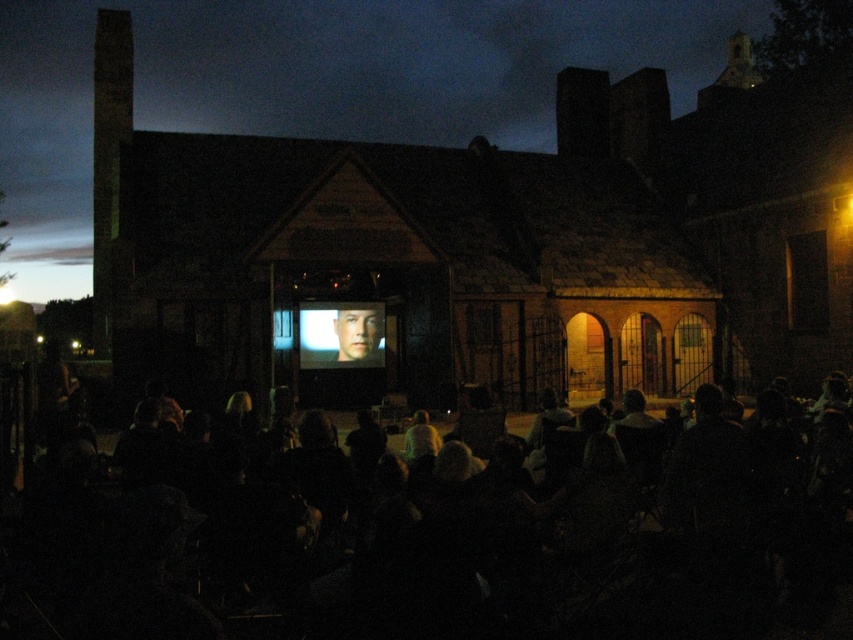
You are organizing a movie night and need to ensure there is enough space between the black fabric chairs at lower center and the matte silver screen at center for attendees to move comfortably. Based on the scene, which object is wider and would require more space?

The black fabric chairs at lower center are wider than the matte silver screen at center, so they would require more space.

You are standing at the point marked as point (440, 552) in the image. What is directly beneath your feet?

The point (440, 552) is directly on black fabric chairs at lower center.

You are a moviegoer trying to find a seat. You see the black fabric chairs at lower center and the matte silver screen at center. Which object is closer to the ground?

The black fabric chairs at lower center are closer to the ground because they are located below the matte silver screen at center.